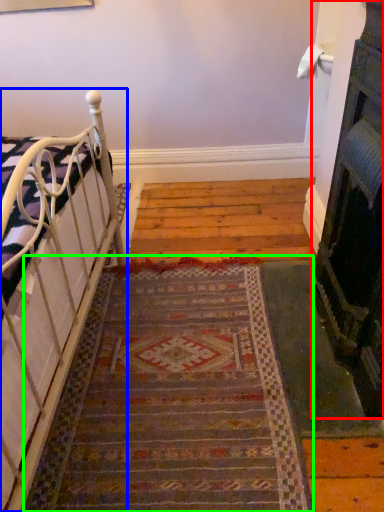
Question: Based on their relative distances, which object is farther from fireplace (highlighted by a red box)? Choose from furniture (highlighted by a blue box) and doormat (highlighted by a green box).

Choices:
 (A) furniture
 (B) doormat

Answer: (A)